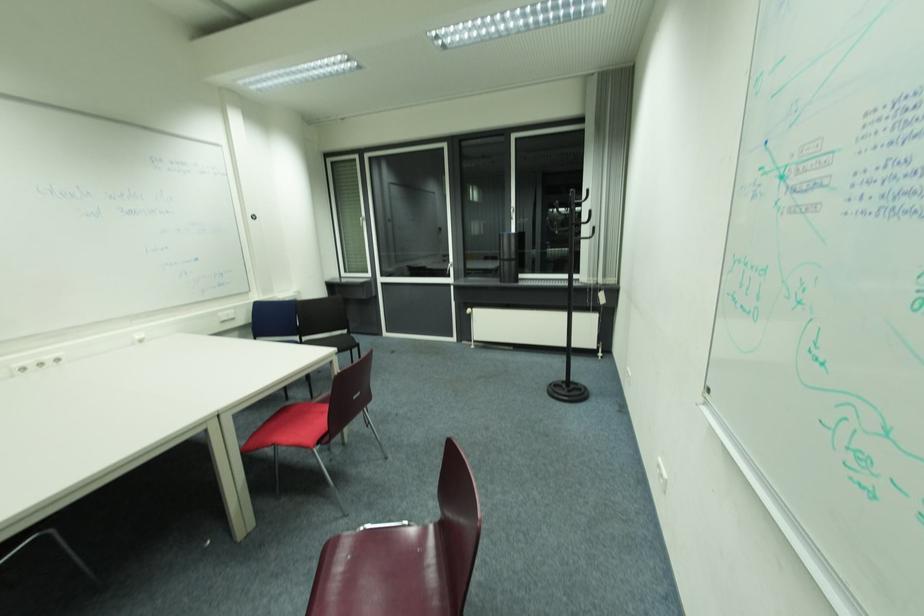
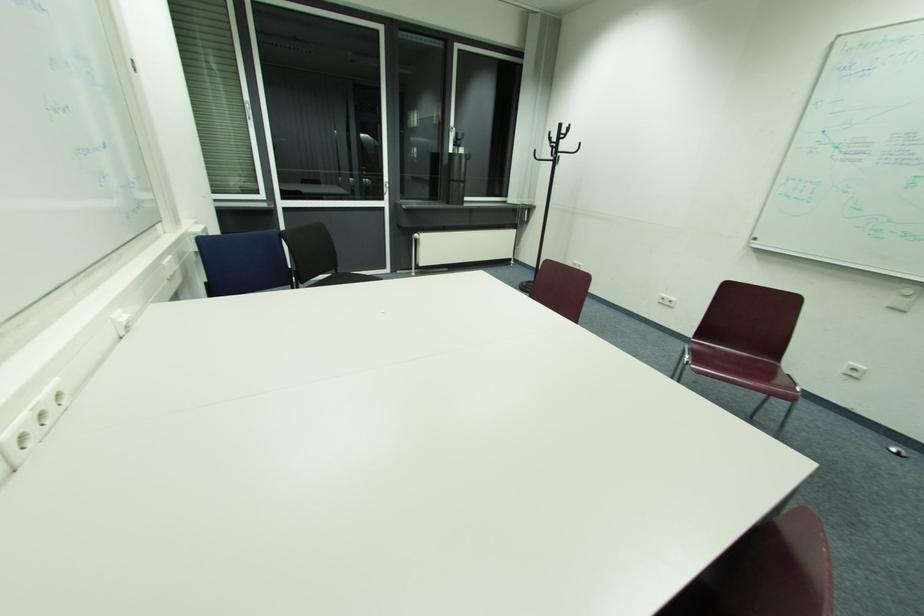
The point at (x=453, y=277) is marked in the first image. Where is the corresponding point in the second image?

(384, 199)